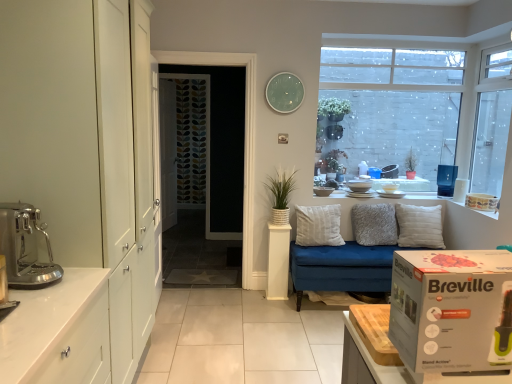
Question: Does point (5, 309) appear closer or farther from the camera than point (490, 117)?

Choices:
 (A) closer
 (B) farther

Answer: (A)

Question: Would you say metallic stainless steel coffee machine at left, which is counted as the 1th appliance, starting from the left, is to the left or to the right of transparent glass window at upper right, the 1th window in the right-to-left sequence, in the picture?

Choices:
 (A) right
 (B) left

Answer: (B)

Question: Which is nearer to the grey fluffy pillow at center, the second pillow viewed from the left?

Choices:
 (A) metallic stainless steel coffee machine at left, which is the fourth appliance in back-to-front order
 (B) white soft cushion at center, the 3th pillow from the right
 (C) white painted wood door at center, which is counted as the first door, starting from the left
 (D) green glass clock at upper center
 (E) white textured pot at center

Answer: (B)

Question: Considering the real-world distances, which object is closest to the white textured pillow at center, the 1th pillow when ordered from right to left?

Choices:
 (A) white glossy cabinet at lower left
 (B) patterned fabric door at center, the second door viewed from the left
 (C) transparent glass window at upper right, placed as the second window when sorted from left to right
 (D) white glossy cup at upper center, which is the first appliance from back to front
 (E) matte ceramic mug at upper center, marked as the second appliance in a back-to-front arrangement

Answer: (D)